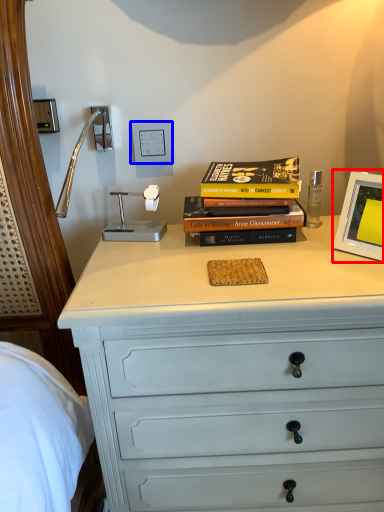
Question: Which object is further to the camera taking this photo, picture frame (highlighted by a red box) or electric outlet (highlighted by a blue box)?

Choices:
 (A) picture frame
 (B) electric outlet

Answer: (B)